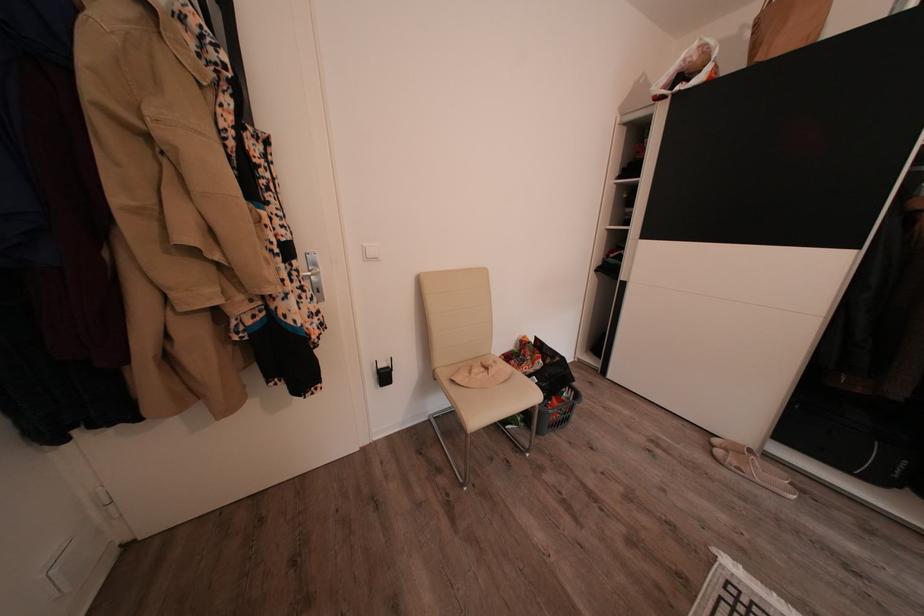
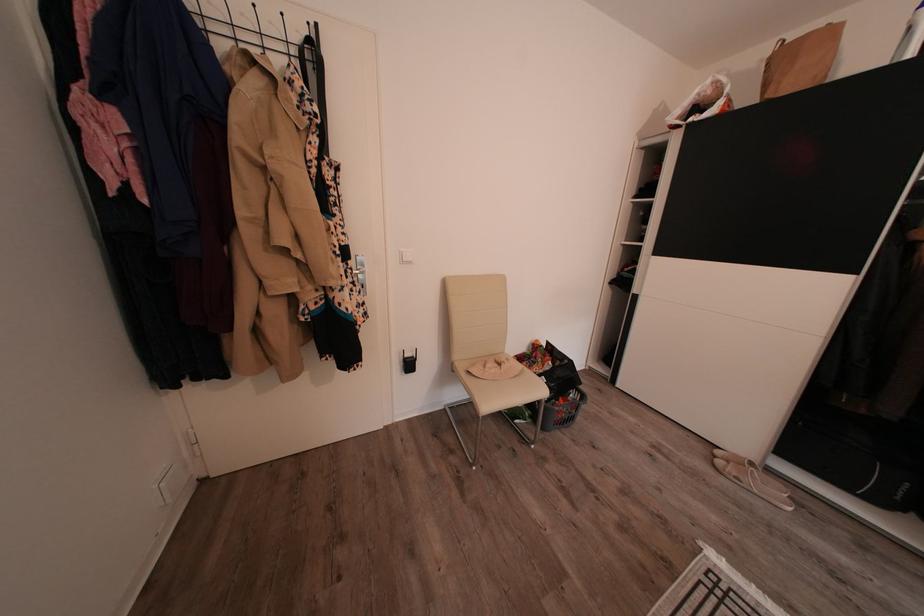
Where in the second image is the point corresponding to point (727, 456) from the first image?

(728, 468)